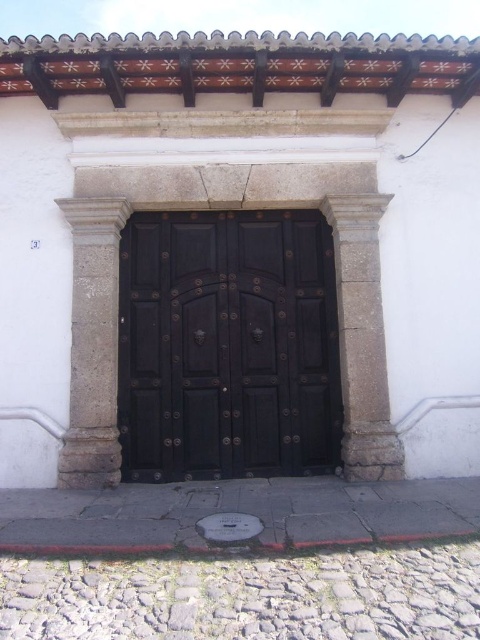
Is black wood door at center to the right of gray stone pillar at left from the viewer's perspective?

Indeed, black wood door at center is positioned on the right side of gray stone pillar at left.

Does black wood door at center have a smaller size compared to gray stone pillar at left?

Actually, black wood door at center might be larger than gray stone pillar at left.

Locate an element on the screen. This screenshot has width=480, height=640. black wood door at center is located at coordinates (228, 346).